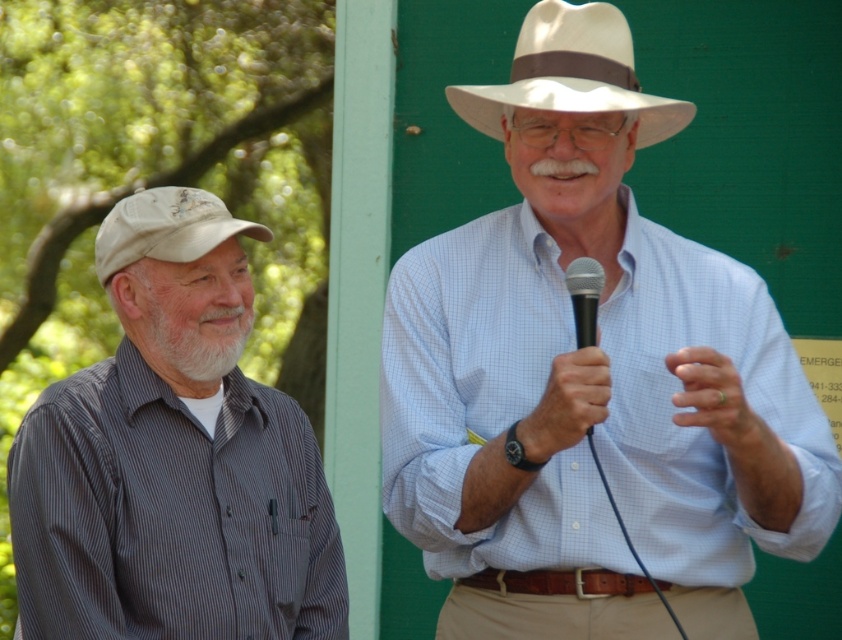
Consider the image. You are a photographer setting up for a group photo. You need to position two props, a gray striped shirt at left and a white felt fedora at upper center, such that they are exactly 24.56 inches apart. Given that your camera measures distances in centimeters, what should be the minimum distance in centimeters you should maintain between these two props to ensure they are precisely positioned as required?

The distance between gray striped shirt at left and white felt fedora at upper center must be 24.56 inches. Converting inches to centimeters, 24.56 inches multiplied by 2.54 equals approximately 62.38 centimeters. Therefore, the minimum distance should be 62.38 centimeters to maintain the required separation.

You are a photographer trying to capture a clear shot of the beige fabric cap at left. However, the gray striped shirt at left is blocking your view. Can you adjust your position to see the cap without moving the subjects?

The gray striped shirt at left is in front of the beige fabric cap at left, so you can move your camera position slightly to the right to see around the gray striped shirt at left and capture the beige fabric cap at left.